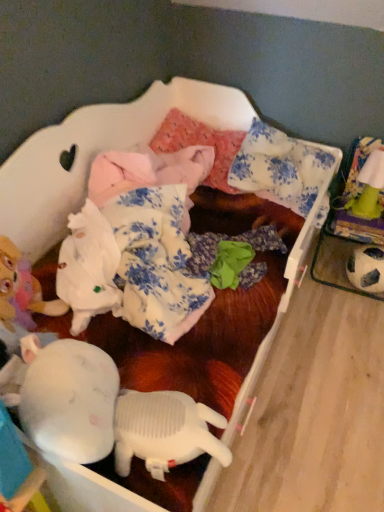
Image resolution: width=384 pixels, height=512 pixels. In order to click on vacant position to the left of black and white textured soccer ball at right, which ranks as the 1th toy in bottom-to-top order in this screenshot , I will do `click(329, 296)`.